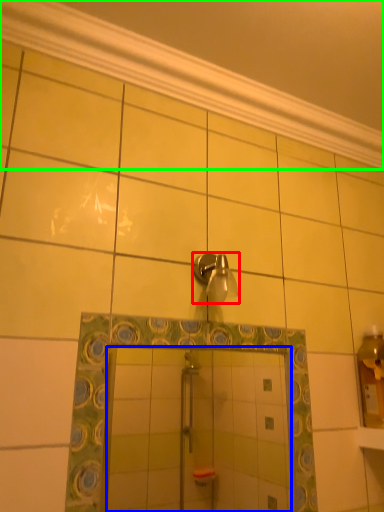
Question: Which is farther away from shower (highlighted by a red box)? mirror (highlighted by a blue box) or molding (highlighted by a green box)?

Choices:
 (A) mirror
 (B) molding

Answer: (A)